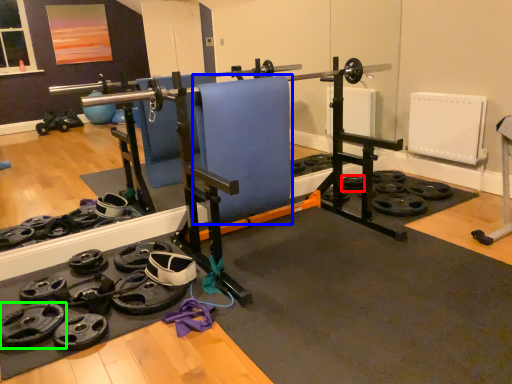
Question: Based on their relative distances, which object is farther from wheel (highlighted by a red box)? Choose from swivel chair (highlighted by a blue box) and wheel (highlighted by a green box).

Choices:
 (A) swivel chair
 (B) wheel

Answer: (B)